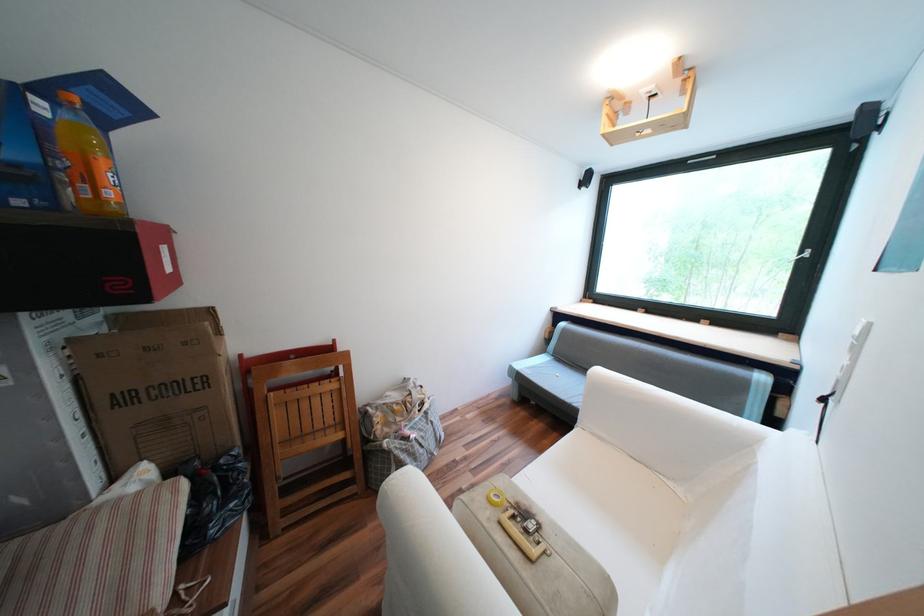
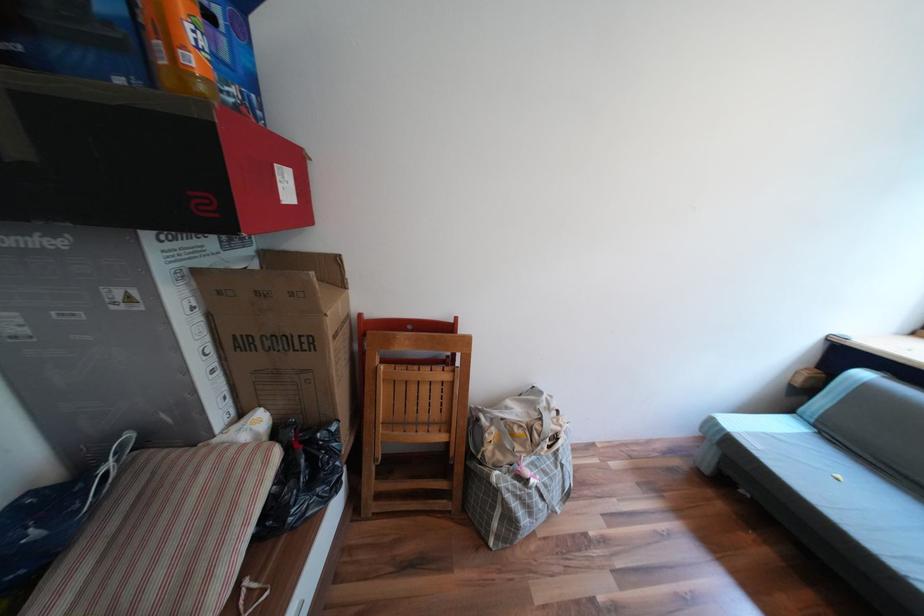
Where in the second image is the point corresponding to [383,419] from the first image?

(495, 435)